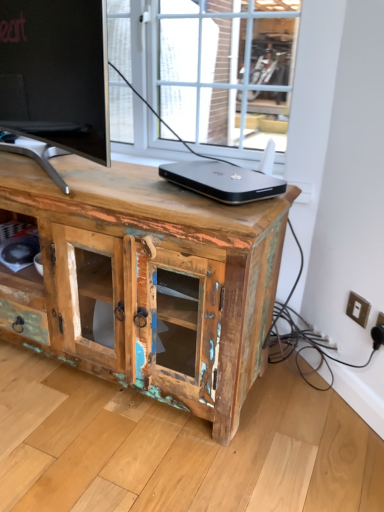
Locate an element on the screen. weathered wood cabinet at center is located at coordinates (147, 281).

Describe the element at coordinates (378, 332) in the screenshot. The width and height of the screenshot is (384, 512). I see `white plastic electric outlet at lower right, which ranks as the 1th electric outlet in front-to-back order` at that location.

The width and height of the screenshot is (384, 512). What are the coordinates of `white plastic switch at lower right, the second electric outlet when ordered from right to left` in the screenshot? It's located at (358, 309).

Consider the image. Is weathered wood cabinet at center completely or partially outside of white plastic electric outlet at lower right, which is counted as the second electric outlet, starting from the back?

Indeed, weathered wood cabinet at center is completely outside white plastic electric outlet at lower right, which is counted as the second electric outlet, starting from the back.

Can you confirm if weathered wood cabinet at center is bigger than white plastic electric outlet at lower right, positioned as the 2th electric outlet in left-to-right order?

Correct, weathered wood cabinet at center is larger in size than white plastic electric outlet at lower right, positioned as the 2th electric outlet in left-to-right order.

Relative to white plastic electric outlet at lower right, positioned as the 2th electric outlet in left-to-right order, is weathered wood cabinet at center in front or behind?

In the image, weathered wood cabinet at center appears in front of white plastic electric outlet at lower right, positioned as the 2th electric outlet in left-to-right order.

In the scene shown: Is weathered wood cabinet at center to the left of white plastic electric outlet at lower right, which is counted as the second electric outlet, starting from the back, from the viewer's perspective?

Correct, you'll find weathered wood cabinet at center to the left of white plastic electric outlet at lower right, which is counted as the second electric outlet, starting from the back.

Is the position of sleek silver laptop at center more distant than that of white plastic electric outlet at lower right, positioned as the first electric outlet in right-to-left order?

No, sleek silver laptop at center is in front of white plastic electric outlet at lower right, positioned as the first electric outlet in right-to-left order.

Does sleek silver laptop at center have a larger size compared to white plastic electric outlet at lower right, which ranks as the 1th electric outlet in front-to-back order?

Indeed, sleek silver laptop at center has a larger size compared to white plastic electric outlet at lower right, which ranks as the 1th electric outlet in front-to-back order.

Looking at this image, which is more to the left, sleek silver laptop at center or white plastic electric outlet at lower right, positioned as the 2th electric outlet in left-to-right order?

Positioned to the left is sleek silver laptop at center.

Are white plastic electric outlet at lower right, which ranks as the 1th electric outlet in front-to-back order, and weathered wood cabinet at center far apart?

No, there isn't a large distance between white plastic electric outlet at lower right, which ranks as the 1th electric outlet in front-to-back order, and weathered wood cabinet at center.

From the image's perspective, relative to weathered wood cabinet at center, is white plastic electric outlet at lower right, positioned as the first electric outlet in right-to-left order, above or below?

Clearly, from the image's perspective, white plastic electric outlet at lower right, positioned as the first electric outlet in right-to-left order, is below weathered wood cabinet at center.

Considering the sizes of objects white plastic electric outlet at lower right, which is counted as the second electric outlet, starting from the back, and weathered wood cabinet at center in the image provided, who is thinner, white plastic electric outlet at lower right, which is counted as the second electric outlet, starting from the back, or weathered wood cabinet at center?

Thinner between the two is white plastic electric outlet at lower right, which is counted as the second electric outlet, starting from the back.

From the image's perspective, is white plastic switch at lower right, which appears as the 1th electric outlet when viewed from the back, located beneath white plastic electric outlet at lower right, which ranks as the 1th electric outlet in front-to-back order?

Incorrect, from the image's perspective, white plastic switch at lower right, which appears as the 1th electric outlet when viewed from the back, is higher than white plastic electric outlet at lower right, which ranks as the 1th electric outlet in front-to-back order.

Is white plastic switch at lower right, placed as the 2th electric outlet when sorted from front to back, far from white plastic electric outlet at lower right, which is counted as the second electric outlet, starting from the back?

No, white plastic switch at lower right, placed as the 2th electric outlet when sorted from front to back, is not far away from white plastic electric outlet at lower right, which is counted as the second electric outlet, starting from the back.

Is point (351, 312) positioned behind point (382, 326)?

Yes, point (351, 312) is farther from viewer.

Are white plastic electric outlet at lower right, which is counted as the second electric outlet, starting from the back, and white plastic switch at lower right, positioned as the first electric outlet in left-to-right order, located far from each other?

That's not correct — white plastic electric outlet at lower right, which is counted as the second electric outlet, starting from the back, is a little close to white plastic switch at lower right, positioned as the first electric outlet in left-to-right order.

Looking at this image, considering the relative positions of white plastic electric outlet at lower right, positioned as the first electric outlet in right-to-left order, and white plastic switch at lower right, placed as the 2th electric outlet when sorted from front to back, in the image provided, is white plastic electric outlet at lower right, positioned as the first electric outlet in right-to-left order, in front of white plastic switch at lower right, placed as the 2th electric outlet when sorted from front to back,?

Yes, white plastic electric outlet at lower right, positioned as the first electric outlet in right-to-left order, is closer to the viewer.

Considering the points (380, 316) and (350, 317), which point is behind, point (380, 316) or point (350, 317)?

Point (350, 317)

From the image's perspective, relative to white plastic switch at lower right, placed as the 2th electric outlet when sorted from front to back, is white plastic electric outlet at lower right, positioned as the first electric outlet in right-to-left order, above or below?

white plastic electric outlet at lower right, positioned as the first electric outlet in right-to-left order, is below white plastic switch at lower right, placed as the 2th electric outlet when sorted from front to back.

Between point (214, 161) and point (366, 310), which one is positioned in front?

Point (366, 310)

Could you measure the distance between sleek silver laptop at center and white plastic switch at lower right, which appears as the 1th electric outlet when viewed from the back?

sleek silver laptop at center is 54.41 centimeters away from white plastic switch at lower right, which appears as the 1th electric outlet when viewed from the back.

From their relative heights in the image, would you say sleek silver laptop at center is taller or shorter than white plastic switch at lower right, the second electric outlet when ordered from right to left?

Considering their sizes, sleek silver laptop at center has less height than white plastic switch at lower right, the second electric outlet when ordered from right to left.

Looking at this image, is sleek silver laptop at center spatially inside white plastic switch at lower right, positioned as the first electric outlet in left-to-right order, or outside of it?

The correct answer is: outside.

Which of these two, white plastic switch at lower right, the second electric outlet when ordered from right to left, or weathered wood cabinet at center, stands shorter?

white plastic switch at lower right, the second electric outlet when ordered from right to left.

Locate an element on the screen. The height and width of the screenshot is (512, 384). the 2nd electric outlet behind the weathered wood cabinet at center, starting your count from the anchor is located at coordinates (358, 309).

Are white plastic switch at lower right, positioned as the first electric outlet in left-to-right order, and weathered wood cabinet at center far apart?

Actually, white plastic switch at lower right, positioned as the first electric outlet in left-to-right order, and weathered wood cabinet at center are a little close together.

Who is more distant, white plastic switch at lower right, the second electric outlet when ordered from right to left, or weathered wood cabinet at center?

white plastic switch at lower right, the second electric outlet when ordered from right to left, is more distant.

Locate an element on the screen. electric outlet that is the 1st object located behind the weathered wood cabinet at center is located at coordinates (378, 332).

Which electric outlet is the 2nd one when counting from the right side of the sleek silver laptop at center? Please provide its 2D coordinates.

[(378, 332)]

From the image, which object appears to be nearer to white plastic switch at lower right, the second electric outlet when ordered from right to left, weathered wood cabinet at center or sleek silver laptop at center?

The object closer to white plastic switch at lower right, the second electric outlet when ordered from right to left, is sleek silver laptop at center.

Looking at the image, which one is located further to weathered wood cabinet at center, sleek silver laptop at center or white plastic switch at lower right, positioned as the first electric outlet in left-to-right order?

white plastic switch at lower right, positioned as the first electric outlet in left-to-right order, lies further to weathered wood cabinet at center than the other object.

From the image, which object appears to be farther from sleek silver laptop at center, white plastic switch at lower right, the second electric outlet when ordered from right to left, or white plastic electric outlet at lower right, which ranks as the 1th electric outlet in front-to-back order?

The object further to sleek silver laptop at center is white plastic electric outlet at lower right, which ranks as the 1th electric outlet in front-to-back order.

Based on the photo, based on their spatial positions, is white plastic switch at lower right, which appears as the 1th electric outlet when viewed from the back, or weathered wood cabinet at center closer to sleek silver laptop at center?

weathered wood cabinet at center is closer to sleek silver laptop at center.

When comparing their distances from weathered wood cabinet at center, does sleek silver laptop at center or white plastic electric outlet at lower right, which is counted as the second electric outlet, starting from the back, seem closer?

Based on the image, sleek silver laptop at center appears to be nearer to weathered wood cabinet at center.

Looking at the image, which one is located further to white plastic switch at lower right, which appears as the 1th electric outlet when viewed from the back, white plastic electric outlet at lower right, positioned as the first electric outlet in right-to-left order, or sleek silver laptop at center?

sleek silver laptop at center is positioned further to the anchor white plastic switch at lower right, which appears as the 1th electric outlet when viewed from the back.

Considering their positions, is white plastic switch at lower right, positioned as the first electric outlet in left-to-right order, positioned further to weathered wood cabinet at center than sleek silver laptop at center?

white plastic switch at lower right, positioned as the first electric outlet in left-to-right order, is further to weathered wood cabinet at center.

From the picture: Estimate the real-world distances between objects in this image. Which object is further from white plastic electric outlet at lower right, positioned as the 2th electric outlet in left-to-right order, weathered wood cabinet at center or white plastic switch at lower right, placed as the 2th electric outlet when sorted from front to back?

weathered wood cabinet at center is positioned further to the anchor white plastic electric outlet at lower right, positioned as the 2th electric outlet in left-to-right order.

Where is `laptop between weathered wood cabinet at center and white plastic electric outlet at lower right, positioned as the first electric outlet in right-to-left order`? laptop between weathered wood cabinet at center and white plastic electric outlet at lower right, positioned as the first electric outlet in right-to-left order is located at coordinates (223, 181).

You are a GUI agent. You are given a task and a screenshot of the screen. Output one action in this format:
    pyautogui.click(x=<x>, y=<y>)
    Task: Click on the electric outlet between sleek silver laptop at center and white plastic electric outlet at lower right, which is counted as the second electric outlet, starting from the back, in the horizontal direction
    This screenshot has height=512, width=384.
    Given the screenshot: What is the action you would take?
    pyautogui.click(x=358, y=309)

This screenshot has height=512, width=384. What are the coordinates of `laptop situated between weathered wood cabinet at center and white plastic switch at lower right, which appears as the 1th electric outlet when viewed from the back, from left to right` in the screenshot? It's located at (223, 181).

Where is `electric outlet between weathered wood cabinet at center and white plastic electric outlet at lower right, which ranks as the 1th electric outlet in front-to-back order, from left to right`? The height and width of the screenshot is (512, 384). electric outlet between weathered wood cabinet at center and white plastic electric outlet at lower right, which ranks as the 1th electric outlet in front-to-back order, from left to right is located at coordinates (358, 309).